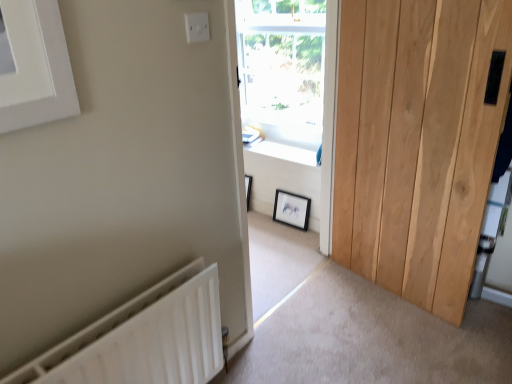
Question: Considering the positions of natural wood door at right and white wood window frame at center in the image, is natural wood door at right bigger or smaller than white wood window frame at center?

Choices:
 (A) big
 (B) small

Answer: (B)

Question: Considering the positions of natural wood door at right and white wood window frame at center in the image, is natural wood door at right wider or thinner than white wood window frame at center?

Choices:
 (A) wide
 (B) thin

Answer: (B)

Question: Which object is positioned farthest from the black matte picture frame at center?

Choices:
 (A) natural wood door at right
 (B) white smooth window sill at center
 (C) white wood window frame at center
 (D) transparent glass window at center
 (E) white plastic electric outlet at upper center

Answer: (E)

Question: Which of these objects is positioned closest to the white wood window frame at center?

Choices:
 (A) white smooth window sill at center
 (B) natural wood door at right
 (C) white plastic electric outlet at upper center
 (D) transparent glass window at center
 (E) white matte radiator at lower left

Answer: (D)